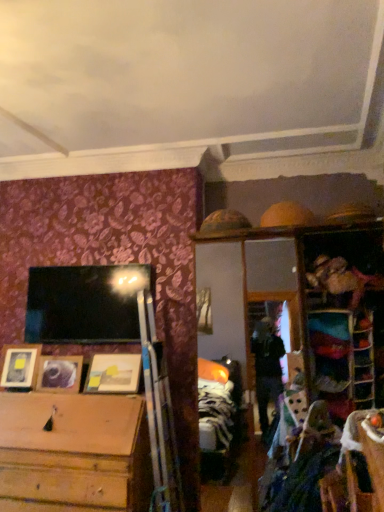
The height and width of the screenshot is (512, 384). What do you see at coordinates (363, 360) in the screenshot?
I see `wooden shelf at right, which is the first shelf from right to left` at bounding box center [363, 360].

Where is `metallic reflective frame at upper right, which is the first shelf from left to right`? Image resolution: width=384 pixels, height=512 pixels. metallic reflective frame at upper right, which is the first shelf from left to right is located at coordinates (342, 355).

Image resolution: width=384 pixels, height=512 pixels. Describe the element at coordinates (114, 374) in the screenshot. I see `wooden picture frame at center, placed as the first picture frame when sorted from right to left` at that location.

How much space does wooden picture frame at lower left, which is counted as the third picture frame, starting from the right, occupy horizontally?

7.24 inches.

Where is `wooden shelf at right, which is the second shelf in left-to-right order`? wooden shelf at right, which is the second shelf in left-to-right order is located at coordinates (363, 360).

From the image's perspective, is wooden picture frame at left, the second picture frame viewed from the left, under wooden shelf at right, which is the first shelf from right to left?

Yes.

From a real-world perspective, does wooden picture frame at left, which is the 2th picture frame in right-to-left order, stand above wooden shelf at right, which is the second shelf in left-to-right order?

Actually, wooden picture frame at left, which is the 2th picture frame in right-to-left order, is physically below wooden shelf at right, which is the second shelf in left-to-right order, in the real world.

Is wooden picture frame at left, the second picture frame viewed from the left, turned away from wooden shelf at right, which is the first shelf from right to left?

No, wooden shelf at right, which is the first shelf from right to left, is not at the back of wooden picture frame at left, the second picture frame viewed from the left.

In terms of width, does wooden picture frame at left, the second picture frame viewed from the left, look wider or thinner when compared to wooden shelf at right, which is the first shelf from right to left?

Clearly, wooden picture frame at left, the second picture frame viewed from the left, has more width compared to wooden shelf at right, which is the first shelf from right to left.

Based on the photo, from a real-world perspective, who is located higher, wooden picture frame at center, which ranks as the third picture frame in left-to-right order, or metallic reflective frame at upper right, the second shelf when ordered from right to left?

metallic reflective frame at upper right, the second shelf when ordered from right to left, is physically above.

Is the depth of wooden picture frame at center, placed as the first picture frame when sorted from right to left, greater than that of metallic reflective frame at upper right, the second shelf when ordered from right to left?

Yes, wooden picture frame at center, placed as the first picture frame when sorted from right to left, is behind metallic reflective frame at upper right, the second shelf when ordered from right to left.

Can you confirm if wooden picture frame at center, placed as the first picture frame when sorted from right to left, is taller than metallic reflective frame at upper right, which is the first shelf from left to right?

In fact, wooden picture frame at center, placed as the first picture frame when sorted from right to left, may be shorter than metallic reflective frame at upper right, which is the first shelf from left to right.

Is wooden picture frame at center, which ranks as the third picture frame in left-to-right order, not within metallic reflective frame at upper right, which is the first shelf from left to right?

That's correct, wooden picture frame at center, which ranks as the third picture frame in left-to-right order, is outside of metallic reflective frame at upper right, which is the first shelf from left to right.

Is wooden picture frame at center, placed as the first picture frame when sorted from right to left, positioned with its back to wooden picture frame at left, which is the 2th picture frame in right-to-left order?

No, wooden picture frame at center, placed as the first picture frame when sorted from right to left, is not facing the opposite direction of wooden picture frame at left, which is the 2th picture frame in right-to-left order.

The height and width of the screenshot is (512, 384). I want to click on the 1st picture frame positioned above the wooden picture frame at left, which is the 2th picture frame in right-to-left order (from a real-world perspective), so click(114, 374).

Which of these two, wooden picture frame at center, placed as the first picture frame when sorted from right to left, or wooden picture frame at left, which is the 2th picture frame in right-to-left order, is wider?

wooden picture frame at center, placed as the first picture frame when sorted from right to left.

Would you consider wooden picture frame at center, which ranks as the third picture frame in left-to-right order, to be distant from wooden picture frame at left, the second picture frame viewed from the left?

They are positioned close to each other.

Can you confirm if metallic reflective frame at upper right, which is the first shelf from left to right, is bigger than wooden picture frame at left, which is the 2th picture frame in right-to-left order?

No.

Does point (316, 338) lie behind point (78, 365)?

No, it is not.

Is metallic reflective frame at upper right, which is the first shelf from left to right, far from wooden picture frame at left, the second picture frame viewed from the left?

Yes, metallic reflective frame at upper right, which is the first shelf from left to right, and wooden picture frame at left, the second picture frame viewed from the left, are located far from each other.

From a real-world perspective, who is located higher, wooden picture frame at center, which ranks as the third picture frame in left-to-right order, or wooden shelf at right, which is the second shelf in left-to-right order?

wooden shelf at right, which is the second shelf in left-to-right order, from a real-world perspective.

From the image's perspective, does wooden picture frame at center, placed as the first picture frame when sorted from right to left, appear higher than wooden shelf at right, which is the second shelf in left-to-right order?

No.

Which is closer, (104, 392) or (355, 366)?

Point (104, 392) is positioned farther from the camera compared to point (355, 366).

Is wooden shelf at right, which is the first shelf from right to left, turned away from wooden picture frame at lower left, which appears as the 1th picture frame when viewed from the left?

wooden shelf at right, which is the first shelf from right to left, is not turned away from wooden picture frame at lower left, which appears as the 1th picture frame when viewed from the left.

Is wooden shelf at right, which is the first shelf from right to left, at the right side of wooden picture frame at lower left, which appears as the 1th picture frame when viewed from the left?

Yes, wooden shelf at right, which is the first shelf from right to left, is to the right of wooden picture frame at lower left, which appears as the 1th picture frame when viewed from the left.

Measure the distance from wooden shelf at right, which is the first shelf from right to left, to wooden picture frame at lower left, which is counted as the third picture frame, starting from the right.

wooden shelf at right, which is the first shelf from right to left, and wooden picture frame at lower left, which is counted as the third picture frame, starting from the right, are 8.26 feet apart from each other.

At what (x,y) coordinates should I click in order to perform the action: click on the 3rd picture frame counting from the left side of the wooden shelf at right, which is the second shelf in left-to-right order. Please return your answer as a coordinate pair (x, y). Looking at the image, I should click on (20, 367).

What's the angular difference between wooden picture frame at lower left, which is counted as the third picture frame, starting from the right, and wooden picture frame at left, the second picture frame viewed from the left,'s facing directions?

10.8 degrees separate the facing orientations of wooden picture frame at lower left, which is counted as the third picture frame, starting from the right, and wooden picture frame at left, the second picture frame viewed from the left.

Which object is more forward, wooden picture frame at lower left, which appears as the 1th picture frame when viewed from the left, or wooden picture frame at left, the second picture frame viewed from the left?

wooden picture frame at left, the second picture frame viewed from the left, is closer to the camera.

Measure the distance from wooden picture frame at lower left, which is counted as the third picture frame, starting from the right, to wooden picture frame at left, which is the 2th picture frame in right-to-left order.

wooden picture frame at lower left, which is counted as the third picture frame, starting from the right, and wooden picture frame at left, which is the 2th picture frame in right-to-left order, are 7.32 inches apart from each other.

Which of these two, wooden picture frame at lower left, which is counted as the third picture frame, starting from the right, or wooden picture frame at left, which is the 2th picture frame in right-to-left order, is bigger?

wooden picture frame at lower left, which is counted as the third picture frame, starting from the right, is bigger.

At what (x,y) coordinates should I click in order to perform the action: click on the 2nd shelf above the wooden picture frame at left, the second picture frame viewed from the left (from a real-world perspective). Please return your answer as a coordinate pair (x, y). The width and height of the screenshot is (384, 512). Looking at the image, I should click on (363, 360).

This screenshot has width=384, height=512. Identify the location of the 1st shelf in front of the wooden picture frame at center, placed as the first picture frame when sorted from right to left, counting from the anchor's position. (342, 355).

Looking at the image, which one is located further to wooden picture frame at lower left, which appears as the 1th picture frame when viewed from the left, wooden shelf at right, which is the first shelf from right to left, or metallic reflective frame at upper right, the second shelf when ordered from right to left?

Based on the image, wooden shelf at right, which is the first shelf from right to left, appears to be further to wooden picture frame at lower left, which appears as the 1th picture frame when viewed from the left.

Considering their positions, is wooden picture frame at left, the second picture frame viewed from the left, positioned closer to metallic reflective frame at upper right, which is the first shelf from left to right, than wooden shelf at right, which is the first shelf from right to left?

wooden shelf at right, which is the first shelf from right to left, is closer to metallic reflective frame at upper right, which is the first shelf from left to right.

Estimate the real-world distances between objects in this image. Which object is closer to metallic reflective frame at upper right, which is the first shelf from left to right, wooden shelf at right, which is the first shelf from right to left, or wooden picture frame at center, placed as the first picture frame when sorted from right to left?

wooden shelf at right, which is the first shelf from right to left, is closer to metallic reflective frame at upper right, which is the first shelf from left to right.

Looking at the image, which one is located further to metallic reflective frame at upper right, the second shelf when ordered from right to left, wooden picture frame at center, which ranks as the third picture frame in left-to-right order, or wooden picture frame at lower left, which is counted as the third picture frame, starting from the right?

wooden picture frame at lower left, which is counted as the third picture frame, starting from the right, is further to metallic reflective frame at upper right, the second shelf when ordered from right to left.

Considering their positions, is wooden picture frame at lower left, which is counted as the third picture frame, starting from the right, positioned further to wooden shelf at right, which is the first shelf from right to left, than wooden picture frame at left, the second picture frame viewed from the left?

Based on the image, wooden picture frame at lower left, which is counted as the third picture frame, starting from the right, appears to be further to wooden shelf at right, which is the first shelf from right to left.

From the image, which object appears to be nearer to wooden picture frame at center, placed as the first picture frame when sorted from right to left, wooden shelf at right, which is the second shelf in left-to-right order, or metallic reflective frame at upper right, the second shelf when ordered from right to left?

metallic reflective frame at upper right, the second shelf when ordered from right to left, is closer to wooden picture frame at center, placed as the first picture frame when sorted from right to left.

Based on their spatial positions, is wooden shelf at right, which is the first shelf from right to left, or wooden picture frame at lower left, which appears as the 1th picture frame when viewed from the left, further from wooden picture frame at center, placed as the first picture frame when sorted from right to left?

Based on the image, wooden shelf at right, which is the first shelf from right to left, appears to be further to wooden picture frame at center, placed as the first picture frame when sorted from right to left.

Based on their spatial positions, is wooden picture frame at left, which is the 2th picture frame in right-to-left order, or wooden shelf at right, which is the second shelf in left-to-right order, further from wooden picture frame at center, placed as the first picture frame when sorted from right to left?

Among the two, wooden shelf at right, which is the second shelf in left-to-right order, is located further to wooden picture frame at center, placed as the first picture frame when sorted from right to left.

You are a GUI agent. You are given a task and a screenshot of the screen. Output one action in this format:
    pyautogui.click(x=<x>, y=<y>)
    Task: Click on the shelf between wooden picture frame at lower left, which appears as the 1th picture frame when viewed from the left, and wooden shelf at right, which is the first shelf from right to left
    This screenshot has width=384, height=512.
    Given the screenshot: What is the action you would take?
    [342, 355]

Identify the location of shelf located between wooden picture frame at center, which ranks as the third picture frame in left-to-right order, and wooden shelf at right, which is the first shelf from right to left, in the left-right direction. (342, 355).

Image resolution: width=384 pixels, height=512 pixels. Identify the location of picture frame situated between wooden picture frame at left, which is the 2th picture frame in right-to-left order, and metallic reflective frame at upper right, the second shelf when ordered from right to left, from left to right. pos(114,374).

The width and height of the screenshot is (384, 512). Identify the location of shelf situated between wooden picture frame at left, the second picture frame viewed from the left, and wooden shelf at right, which is the first shelf from right to left, from left to right. (342, 355).